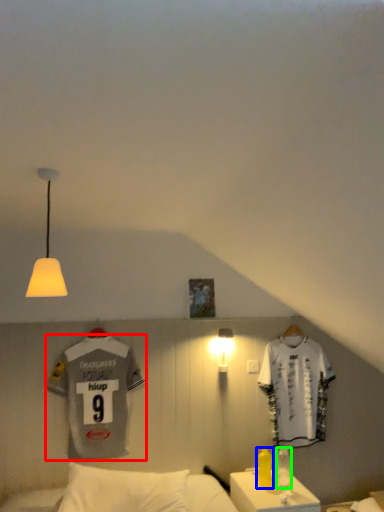
Question: Which is farther away from sports uniform (highlighted by a red box)? bottle (highlighted by a blue box) or bottle (highlighted by a green box)?

Choices:
 (A) bottle
 (B) bottle

Answer: (B)